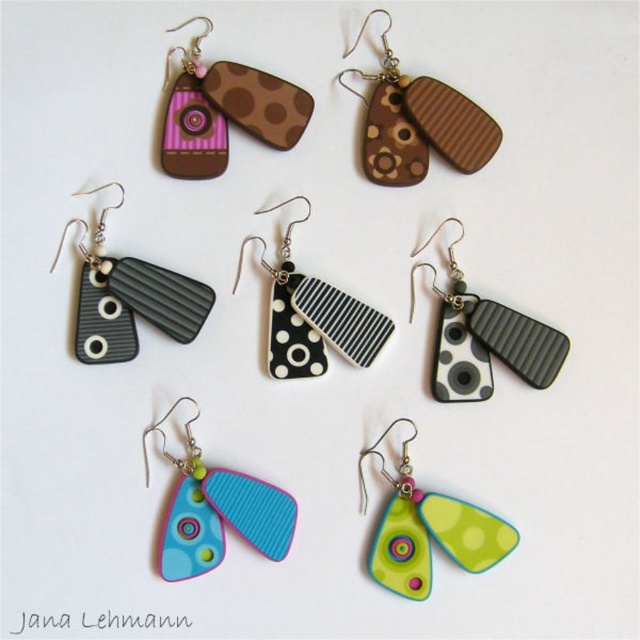
You are trying to place the matte plastic earrings at center and the matte black rectangular at center into a jewelry box compartment that can only fit items up to 3 cm in width. Based on the image, can you determine which of these two items might not fit?

The matte plastic earrings at center might be wider than the matte black rectangular at center. Since the compartment can only fit items up to 3 cm in width, if the matte plastic earrings at center are wider, they might not fit.

You are organizing a jewelry display and need to arrange the matte plastic earrings at center and the matte black rectangular at center based on their height. Which one should you place higher up to ensure proper visibility?

The matte black rectangular at center should be placed higher up since it is taller than the matte plastic earrings at center, ensuring better visibility for both items.